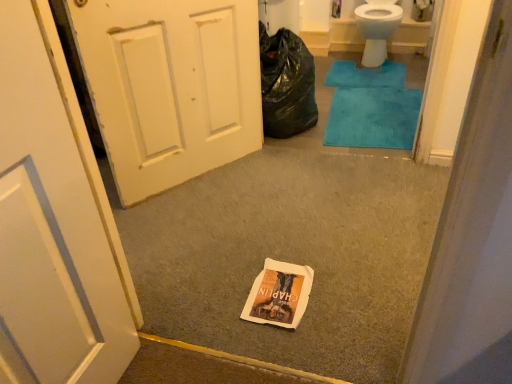
The height and width of the screenshot is (384, 512). I want to click on free space to the right of black plastic bag at upper right, so click(x=354, y=112).